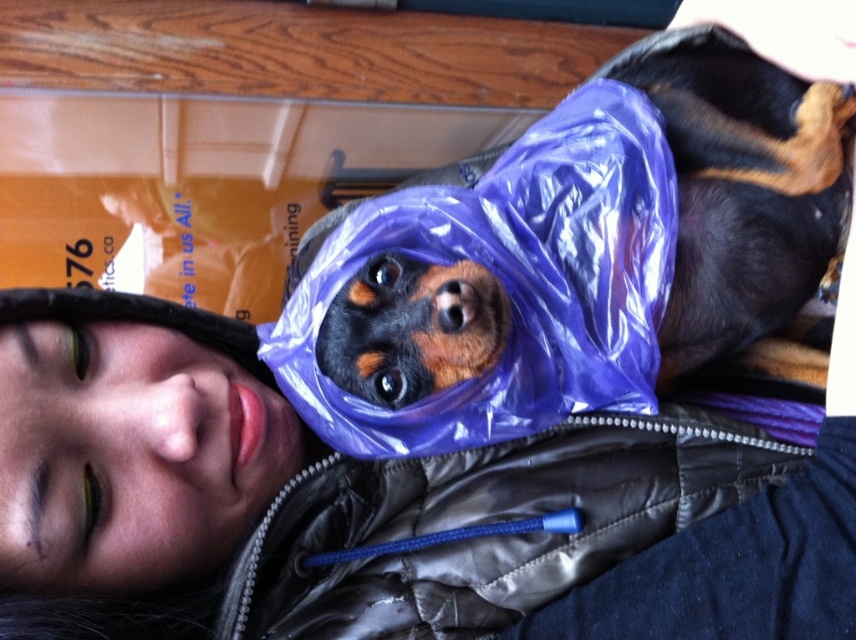
You are a delivery person who needs to place a box between the matte black jacket at upper left and the shiny purple plastic bag at center. The box is 4 inches long. Can you fit the box between them without overlapping either object?

The distance between the matte black jacket at upper left and the shiny purple plastic bag at center is 3.91 inches. Since the box is 4 inches long, it cannot fit between them without overlapping one of the objects.

You are an interior designer assessing the layout of this indoor space. You need to determine if the matte black jacket at upper left is placed above or below the shiny purple plastic bag at center. Based on the scene, what is your assessment?

The matte black jacket at upper left is located below the shiny purple plastic bag at center, so it is placed below.